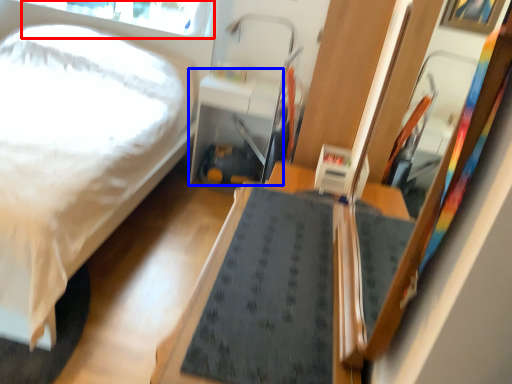
Question: Which object appears closest to the camera in this image, window screen (highlighted by a red box) or table (highlighted by a blue box)?

Choices:
 (A) window screen
 (B) table

Answer: (B)